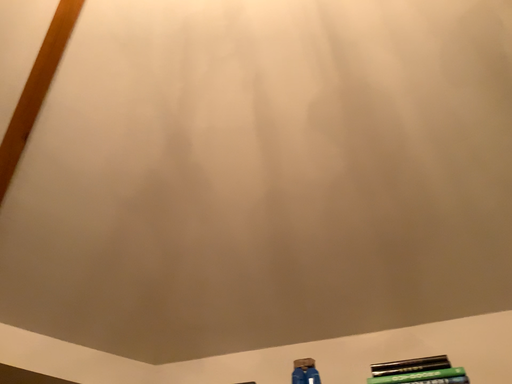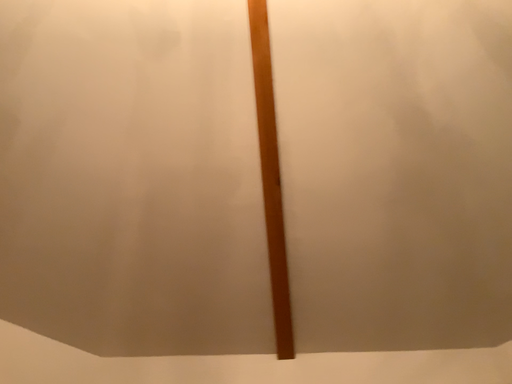
Question: Which way did the camera rotate in the video?

Choices:
 (A) rotated right
 (B) rotated left

Answer: (B)